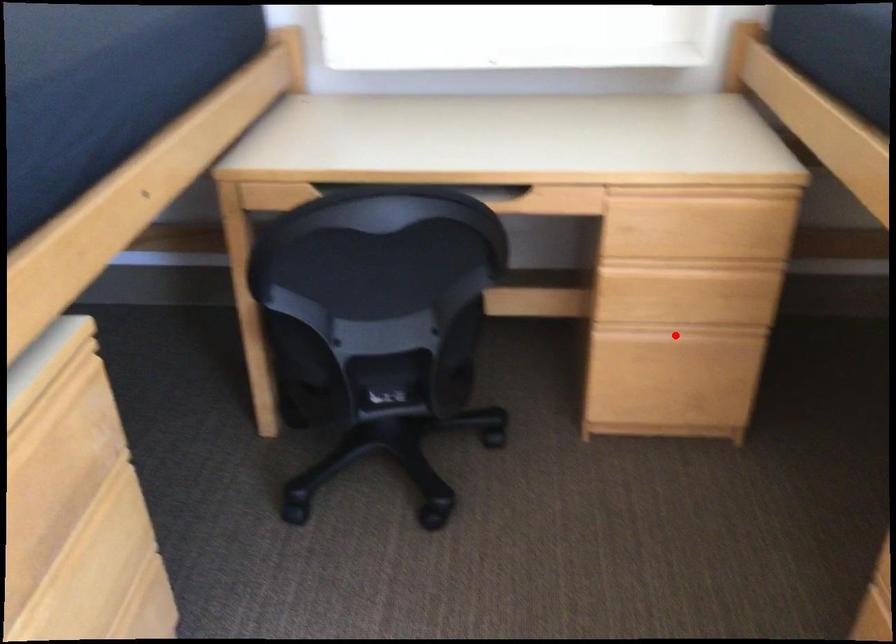
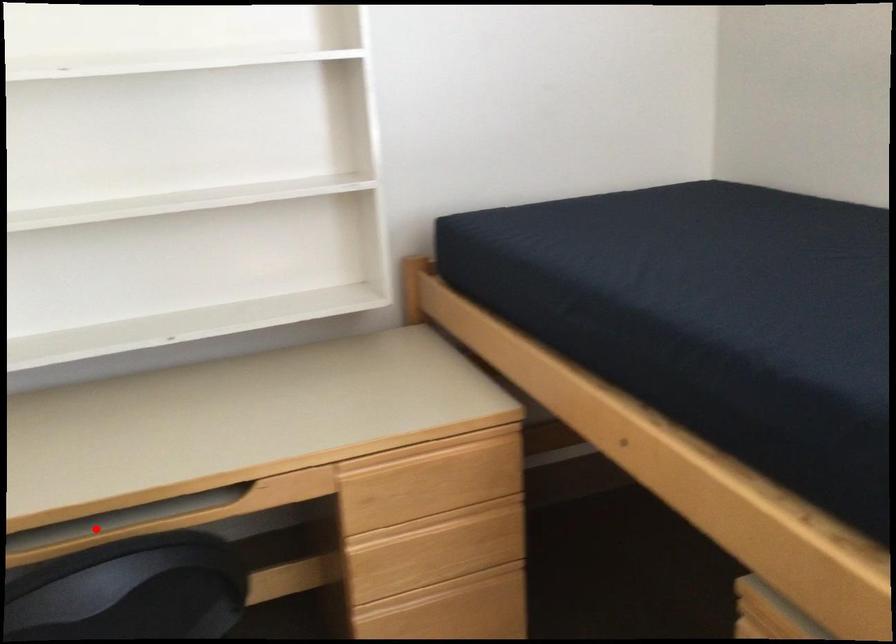
I am providing you with two images of the same scene from different viewpoints. A red point is marked on the first image and another point is marked on the second image. Are the points marked in image1 and image2 representing the same 3D position?

No